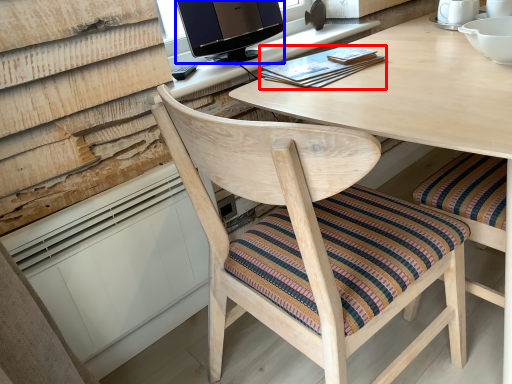
Question: Which object is closer to the camera taking this photo, book (highlighted by a red box) or television (highlighted by a blue box)?

Choices:
 (A) book
 (B) television

Answer: (A)